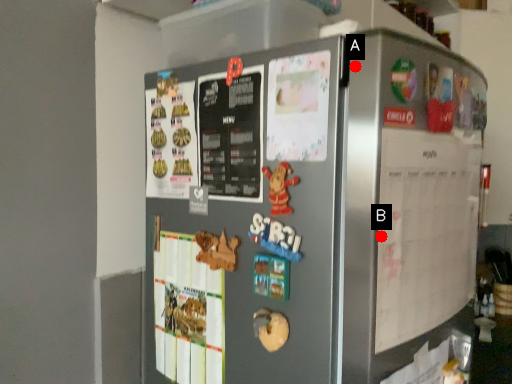
Question: Two points are circled on the image, labeled by A and B beside each circle. Which of the following is the closest to the observer?

Choices:
 (A) A is closer
 (B) B is closer

Answer: (B)